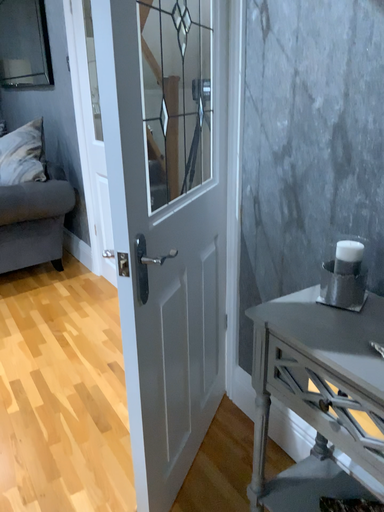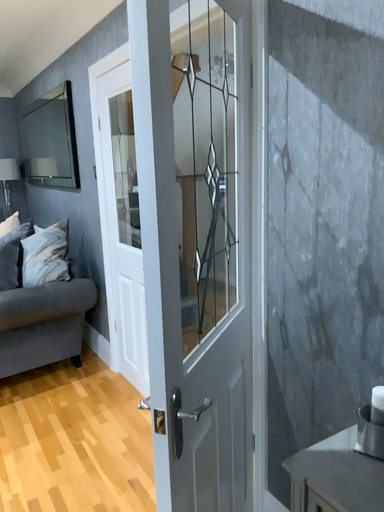
Question: How did the camera likely rotate when shooting the video?

Choices:
 (A) rotated downward
 (B) rotated upward

Answer: (B)